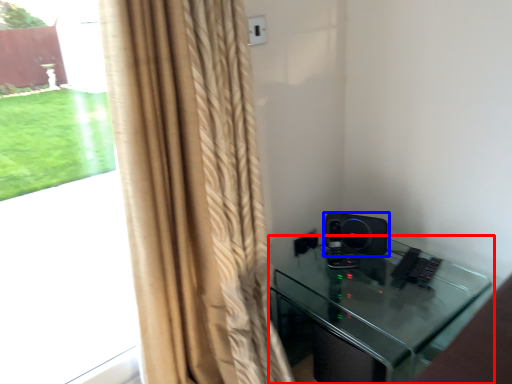
Question: Which point is further to the camera, furniture (highlighted by a red box) or speaker (highlighted by a blue box)?

Choices:
 (A) furniture
 (B) speaker

Answer: (B)